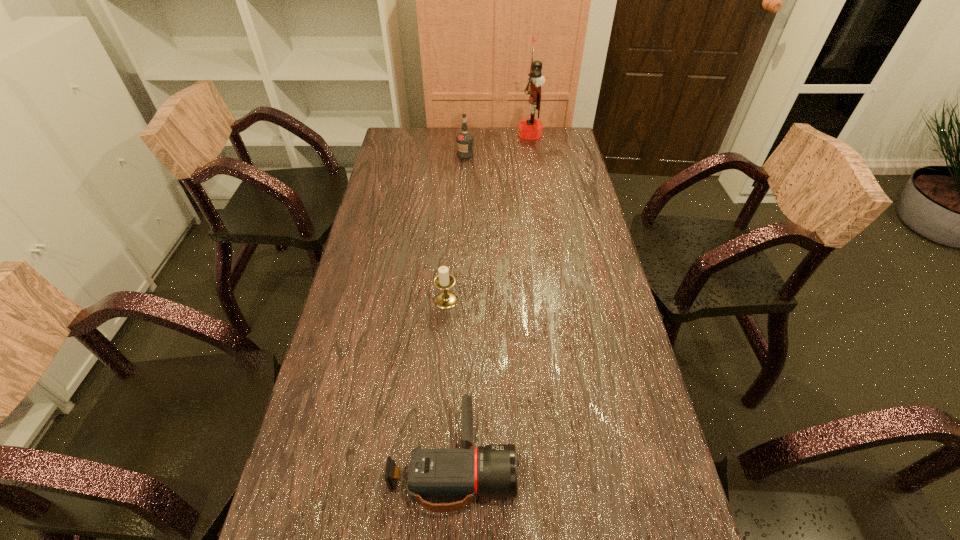
This screenshot has width=960, height=540. In order to click on the tallest object in this screenshot , I will do `click(530, 129)`.

This screenshot has height=540, width=960. I want to click on the rightmost object, so click(530, 129).

Identify the location of the second tallest object. The image size is (960, 540). (464, 139).

Image resolution: width=960 pixels, height=540 pixels. In order to click on the third nearest object in this screenshot , I will do [x=464, y=139].

Find the location of a particular element. the third tallest object is located at coordinates (445, 300).

Locate an element on the screen. candle holder is located at coordinates coord(445,300).

The width and height of the screenshot is (960, 540). What are the coordinates of `the shortest object` in the screenshot? It's located at click(434, 474).

The width and height of the screenshot is (960, 540). Identify the location of the nearest object. (434, 474).

Where is `vacant space located 0.390m on the front-facing side of the farthest object`? The image size is (960, 540). vacant space located 0.390m on the front-facing side of the farthest object is located at coordinates (429, 134).

Locate an element on the screen. free space located 0.280m on the front-facing side of the farthest object is located at coordinates (454, 134).